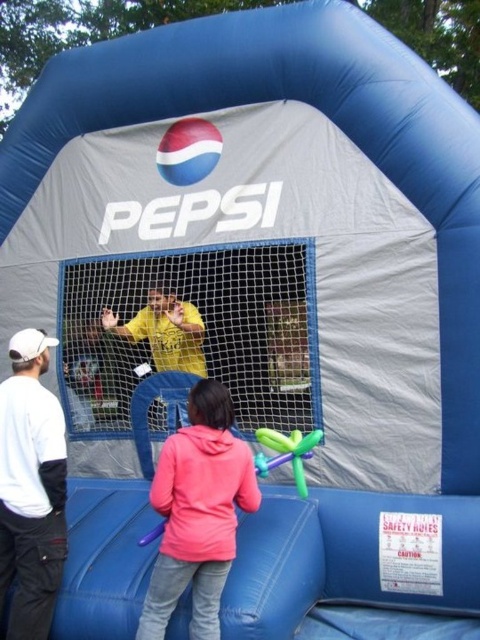
Question: Which point is farther to the camera?

Choices:
 (A) pink fleece sweatshirt at lower center
 (B) white fabric pants at lower left
 (C) yellow matte shirt at center
 (D) pink fleece jacket at lower center

Answer: (C)

Question: Which of the following is the closest to the observer?

Choices:
 (A) pink fleece jacket at lower center
 (B) white fabric pants at lower left

Answer: (A)

Question: Is the position of white fabric pants at lower left less distant than that of yellow matte shirt at center?

Choices:
 (A) no
 (B) yes

Answer: (B)

Question: Which of the following is the farthest from the observer?

Choices:
 (A) (172, 525)
 (B) (41, 600)

Answer: (B)

Question: Is pink fleece jacket at lower center smaller than pink fleece sweatshirt at lower center?

Choices:
 (A) yes
 (B) no

Answer: (B)

Question: Considering the relative positions of pink fleece sweatshirt at lower center and yellow matte shirt at center in the image provided, where is pink fleece sweatshirt at lower center located with respect to yellow matte shirt at center?

Choices:
 (A) below
 (B) above

Answer: (A)